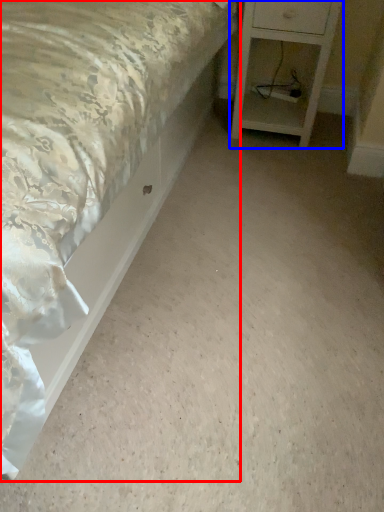
Question: Which of the following is the closest to the observer, bed (highlighted by a red box) or nightstand (highlighted by a blue box)?

Choices:
 (A) bed
 (B) nightstand

Answer: (A)